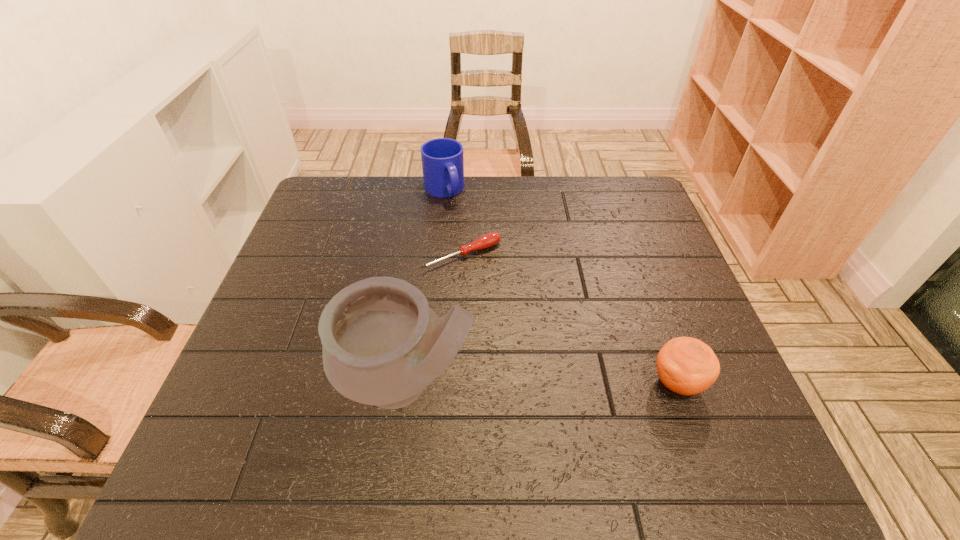
Identify the location of vacant area between the tallest object and the orange. [542, 383].

You are a GUI agent. You are given a task and a screenshot of the screen. Output one action in this format:
    pyautogui.click(x=<x>, y=<y>)
    Task: Click on the vacant space in between the tallest object and the farthest object
    The width and height of the screenshot is (960, 540).
    Given the screenshot: What is the action you would take?
    (x=425, y=287)

Locate an element on the screen. The height and width of the screenshot is (540, 960). vacant area between the pottery and the orange is located at coordinates (542, 383).

The height and width of the screenshot is (540, 960). In order to click on free spot between the rightmost object and the farthest object in this screenshot , I will do `click(561, 286)`.

Identify the location of object that is the closest to the shortest object. The height and width of the screenshot is (540, 960). (442, 159).

Choose which object is the nearest neighbor to the tallest object. Please provide its 2D coordinates. Your answer should be formatted as a tuple, i.e. [(x, y)], where the tuple contains the x and y coordinates of a point satisfying the conditions above.

[(488, 240)]

In order to click on free space that satisfies the following two spatial constraints: 1. on the back side of the farthest object; 2. on the right side of the pottery in this screenshot , I will do `click(433, 190)`.

Where is `free point that satisfies the following two spatial constraints: 1. on the front side of the farthest object; 2. on the right side of the rightmost object`? free point that satisfies the following two spatial constraints: 1. on the front side of the farthest object; 2. on the right side of the rightmost object is located at coordinates (424, 382).

Locate an element on the screen. vacant position in the image that satisfies the following two spatial constraints: 1. on the front side of the mug; 2. on the right side of the rightmost object is located at coordinates (424, 382).